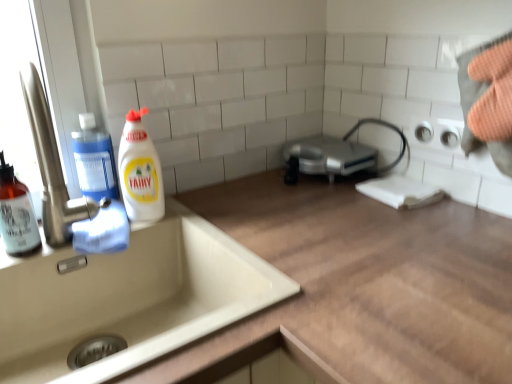
Question: Considering the relative sizes of translucent amber bottle at left, which is the third cleaning product in right-to-left order, and silver metallic toaster at center in the image provided, is translucent amber bottle at left, which is the third cleaning product in right-to-left order, wider than silver metallic toaster at center?

Choices:
 (A) no
 (B) yes

Answer: (A)

Question: Considering the relative positions of translucent amber bottle at left, the 1th cleaning product when ordered from left to right, and silver metallic toaster at center in the image provided, is translucent amber bottle at left, the 1th cleaning product when ordered from left to right, behind silver metallic toaster at center?

Choices:
 (A) no
 (B) yes

Answer: (A)

Question: Is translucent amber bottle at left, the 1th cleaning product when ordered from left to right, far from silver metallic toaster at center?

Choices:
 (A) yes
 (B) no

Answer: (B)

Question: From a real-world perspective, is translucent amber bottle at left, which is the third cleaning product in right-to-left order, positioned under silver metallic toaster at center based on gravity?

Choices:
 (A) no
 (B) yes

Answer: (A)

Question: Is translucent amber bottle at left, the 1th cleaning product when ordered from left to right, to the left of silver metallic toaster at center from the viewer's perspective?

Choices:
 (A) no
 (B) yes

Answer: (B)

Question: From a real-world perspective, is translucent amber bottle at left, the 1th cleaning product when ordered from left to right, on top of silver metallic toaster at center?

Choices:
 (A) no
 (B) yes

Answer: (B)

Question: Does beige ceramic sink at lower left have a smaller size compared to translucent amber bottle at left, which is the third cleaning product in right-to-left order?

Choices:
 (A) no
 (B) yes

Answer: (A)

Question: From the image's perspective, is beige ceramic sink at lower left on translucent amber bottle at left, which is the third cleaning product in right-to-left order?

Choices:
 (A) no
 (B) yes

Answer: (A)

Question: Is beige ceramic sink at lower left bigger than translucent amber bottle at left, which is the third cleaning product in right-to-left order?

Choices:
 (A) yes
 (B) no

Answer: (A)

Question: Is beige ceramic sink at lower left aimed at translucent amber bottle at left, the 1th cleaning product when ordered from left to right?

Choices:
 (A) no
 (B) yes

Answer: (A)

Question: Is the depth of beige ceramic sink at lower left less than that of translucent amber bottle at left, which is the third cleaning product in right-to-left order?

Choices:
 (A) no
 (B) yes

Answer: (B)

Question: Is beige ceramic sink at lower left behind translucent amber bottle at left, which is the third cleaning product in right-to-left order?

Choices:
 (A) yes
 (B) no

Answer: (B)

Question: Is transparent plastic soap dispenser at left, which is the second cleaning product from right to left, behind translucent amber bottle at left, the 1th cleaning product when ordered from left to right?

Choices:
 (A) no
 (B) yes

Answer: (B)